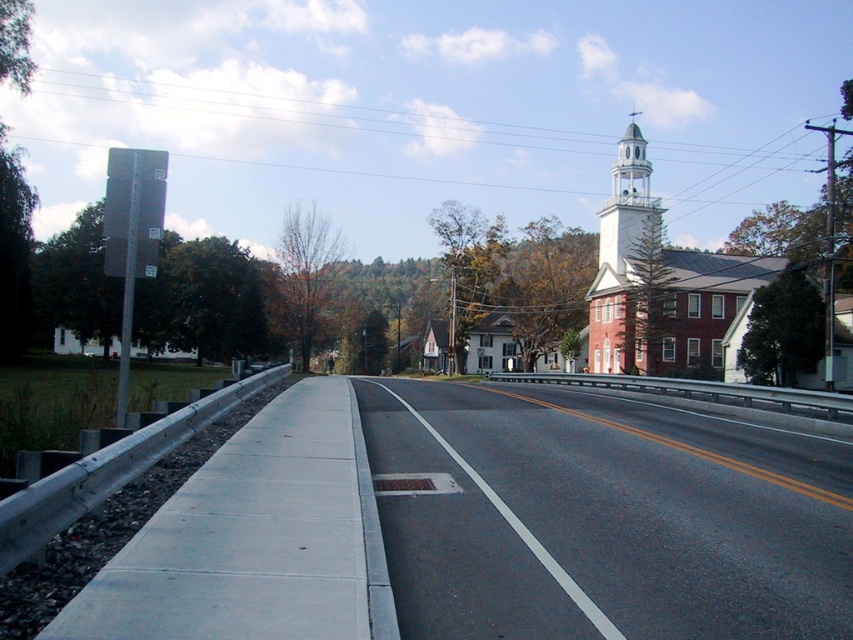
Is asphalt road at center smaller than white stucco bell tower at upper right?

Correct, asphalt road at center occupies less space than white stucco bell tower at upper right.

Between point (460, 458) and point (630, 189), which one is positioned behind?

The point (630, 189) is behind.

Describe the element at coordinates (602, 516) in the screenshot. I see `asphalt road at center` at that location.

This screenshot has width=853, height=640. Find the location of `asphalt road at center`. asphalt road at center is located at coordinates (602, 516).